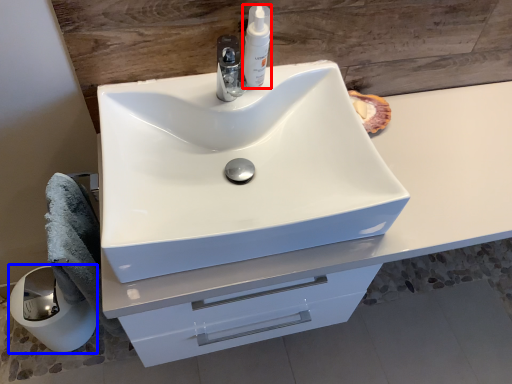
Question: Among these objects, which one is farthest to the camera, soap dispenser (highlighted by a red box) or paper towel (highlighted by a blue box)?

Choices:
 (A) soap dispenser
 (B) paper towel

Answer: (B)